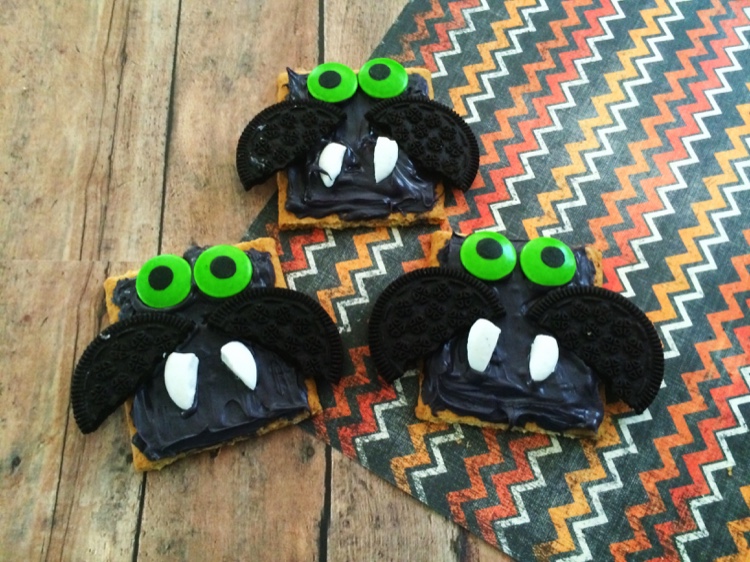
In order to click on cracks between boards in this screenshot , I will do `click(316, 22)`, `click(168, 187)`.